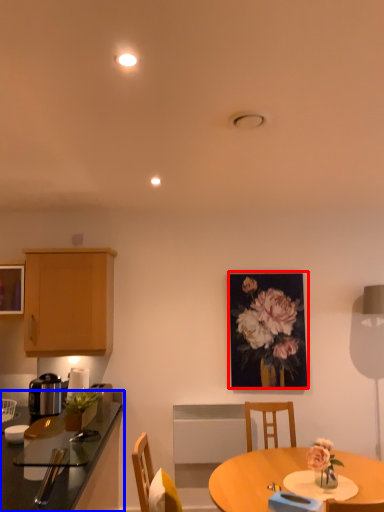
Question: Which of the following is the closest to the observer, picture frame (highlighted by a red box) or countertop (highlighted by a blue box)?

Choices:
 (A) picture frame
 (B) countertop

Answer: (B)